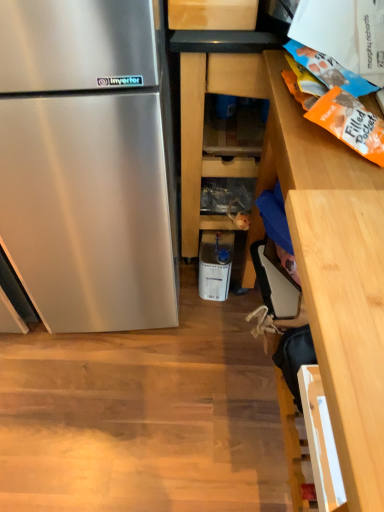
Image resolution: width=384 pixels, height=512 pixels. What do you see at coordinates (215, 265) in the screenshot?
I see `white plastic container at center` at bounding box center [215, 265].

What are the coordinates of `wooden shelves at center, arranged as the 1th cabinetry when viewed from the left` in the screenshot? It's located at (216, 118).

Does white plastic container at center turn towards wooden shelves at center, arranged as the 1th cabinetry when viewed from the left?

No.

This screenshot has height=512, width=384. Find the location of `appliance beneath the wooden shelves at center, which ranks as the 2th cabinetry in right-to-left order (from a real-world perspective)`. appliance beneath the wooden shelves at center, which ranks as the 2th cabinetry in right-to-left order (from a real-world perspective) is located at coordinates (215, 265).

Between point (200, 260) and point (194, 208), which one is positioned behind?

The point (200, 260) is more distant.

The image size is (384, 512). I want to click on appliance lying on the left of wooden cabinet at right, arranged as the first cabinetry when viewed from the right, so click(x=215, y=265).

Is point (379, 391) closer or farther from the camera than point (229, 251)?

Point (379, 391) is closer to the camera than point (229, 251).

Is wooden cabinet at right, which is counted as the second cabinetry, starting from the left, not within white plastic container at center?

Absolutely, wooden cabinet at right, which is counted as the second cabinetry, starting from the left, is external to white plastic container at center.

From a real-world perspective, is wooden cabinet at right, which is counted as the second cabinetry, starting from the left, physically below white plastic container at center?

Incorrect, from a real-world perspective, wooden cabinet at right, which is counted as the second cabinetry, starting from the left, is higher than white plastic container at center.

Would you say wooden cabinet at right, arranged as the first cabinetry when viewed from the right, is a long distance from wooden shelves at center, which ranks as the 2th cabinetry in right-to-left order?

No, wooden cabinet at right, arranged as the first cabinetry when viewed from the right, is not far from wooden shelves at center, which ranks as the 2th cabinetry in right-to-left order.

Could you measure the distance between wooden cabinet at right, arranged as the first cabinetry when viewed from the right, and wooden shelves at center, which ranks as the 2th cabinetry in right-to-left order?

wooden cabinet at right, arranged as the first cabinetry when viewed from the right, and wooden shelves at center, which ranks as the 2th cabinetry in right-to-left order, are 15.11 inches apart.

Does wooden cabinet at right, which is counted as the second cabinetry, starting from the left, turn towards wooden shelves at center, which ranks as the 2th cabinetry in right-to-left order?

No, wooden cabinet at right, which is counted as the second cabinetry, starting from the left, does not turn towards wooden shelves at center, which ranks as the 2th cabinetry in right-to-left order.

Considering the relative positions of wooden cabinet at right, which is counted as the second cabinetry, starting from the left, and wooden shelves at center, which ranks as the 2th cabinetry in right-to-left order, in the image provided, is wooden cabinet at right, which is counted as the second cabinetry, starting from the left, to the left or to the right of wooden shelves at center, which ranks as the 2th cabinetry in right-to-left order,?

Clearly, wooden cabinet at right, which is counted as the second cabinetry, starting from the left, is on the right of wooden shelves at center, which ranks as the 2th cabinetry in right-to-left order, in the image.

Does white plastic container at center turn towards wooden cabinet at right, which is counted as the second cabinetry, starting from the left?

No, white plastic container at center is not aimed at wooden cabinet at right, which is counted as the second cabinetry, starting from the left.

Based on the photo, do you think white plastic container at center is within wooden cabinet at right, arranged as the first cabinetry when viewed from the right, or outside of it?

white plastic container at center is outside wooden cabinet at right, arranged as the first cabinetry when viewed from the right.

In the scene shown: Is white plastic container at center at the left side of wooden cabinet at right, which is counted as the second cabinetry, starting from the left?

Yes.

Which of these two, white plastic container at center or wooden cabinet at right, which is counted as the second cabinetry, starting from the left, is smaller?

Smaller between the two is white plastic container at center.

Can you confirm if wooden shelves at center, which ranks as the 2th cabinetry in right-to-left order, is taller than white plastic container at center?

Yes.

Is white plastic container at center at the back of wooden shelves at center, arranged as the 1th cabinetry when viewed from the left?

That's not correct — wooden shelves at center, arranged as the 1th cabinetry when viewed from the left, is not looking away from white plastic container at center.

From the image's perspective, would you say wooden shelves at center, which ranks as the 2th cabinetry in right-to-left order, is positioned over white plastic container at center?

Yes, from the image's perspective, wooden shelves at center, which ranks as the 2th cabinetry in right-to-left order, is above white plastic container at center.

From a real-world perspective, is wooden shelves at center, arranged as the 1th cabinetry when viewed from the left, on white plastic container at center?

Yes, from a real-world perspective, wooden shelves at center, arranged as the 1th cabinetry when viewed from the left, is on top of white plastic container at center.

Between point (182, 172) and point (303, 148), which one is positioned behind?

The point (182, 172) is behind.

Which is correct: wooden shelves at center, which ranks as the 2th cabinetry in right-to-left order, is inside wooden cabinet at right, arranged as the first cabinetry when viewed from the right, or outside of it?

wooden shelves at center, which ranks as the 2th cabinetry in right-to-left order, is located beyond the bounds of wooden cabinet at right, arranged as the first cabinetry when viewed from the right.

Would you consider wooden shelves at center, which ranks as the 2th cabinetry in right-to-left order, to be distant from wooden cabinet at right, which is counted as the second cabinetry, starting from the left?

wooden shelves at center, which ranks as the 2th cabinetry in right-to-left order, is actually quite close to wooden cabinet at right, which is counted as the second cabinetry, starting from the left.

Which object is further away from the camera, wooden shelves at center, which ranks as the 2th cabinetry in right-to-left order, or wooden cabinet at right, arranged as the first cabinetry when viewed from the right?

Positioned behind is wooden shelves at center, which ranks as the 2th cabinetry in right-to-left order.

Find the location of a particular element. The image size is (384, 512). appliance behind the wooden shelves at center, arranged as the 1th cabinetry when viewed from the left is located at coordinates (215, 265).

The width and height of the screenshot is (384, 512). I want to click on appliance below the wooden cabinet at right, which is counted as the second cabinetry, starting from the left (from a real-world perspective), so click(215, 265).

From the image, which object appears to be nearer to wooden cabinet at right, which is counted as the second cabinetry, starting from the left, wooden shelves at center, arranged as the 1th cabinetry when viewed from the left, or white plastic container at center?

wooden shelves at center, arranged as the 1th cabinetry when viewed from the left, lies closer to wooden cabinet at right, which is counted as the second cabinetry, starting from the left, than the other object.

From the image, which object appears to be nearer to wooden shelves at center, which ranks as the 2th cabinetry in right-to-left order, white plastic container at center or wooden cabinet at right, which is counted as the second cabinetry, starting from the left?

Among the two, white plastic container at center is located nearer to wooden shelves at center, which ranks as the 2th cabinetry in right-to-left order.

Looking at the image, which one is located further to white plastic container at center, wooden cabinet at right, which is counted as the second cabinetry, starting from the left, or wooden shelves at center, arranged as the 1th cabinetry when viewed from the left?

wooden cabinet at right, which is counted as the second cabinetry, starting from the left, is further to white plastic container at center.

Based on their spatial positions, is white plastic container at center or wooden shelves at center, which ranks as the 2th cabinetry in right-to-left order, closer to wooden cabinet at right, which is counted as the second cabinetry, starting from the left?

wooden shelves at center, which ranks as the 2th cabinetry in right-to-left order, is closer to wooden cabinet at right, which is counted as the second cabinetry, starting from the left.

Estimate the real-world distances between objects in this image. Which object is closer to wooden shelves at center, arranged as the 1th cabinetry when viewed from the left, wooden cabinet at right, which is counted as the second cabinetry, starting from the left, or white plastic container at center?

The object closer to wooden shelves at center, arranged as the 1th cabinetry when viewed from the left, is white plastic container at center.

Based on their spatial positions, is wooden shelves at center, arranged as the 1th cabinetry when viewed from the left, or wooden cabinet at right, which is counted as the second cabinetry, starting from the left, further from white plastic container at center?

Based on the image, wooden cabinet at right, which is counted as the second cabinetry, starting from the left, appears to be further to white plastic container at center.

Locate an element on the screen. The height and width of the screenshot is (512, 384). cabinetry between wooden cabinet at right, arranged as the first cabinetry when viewed from the right, and white plastic container at center, along the z-axis is located at coordinates (216, 118).